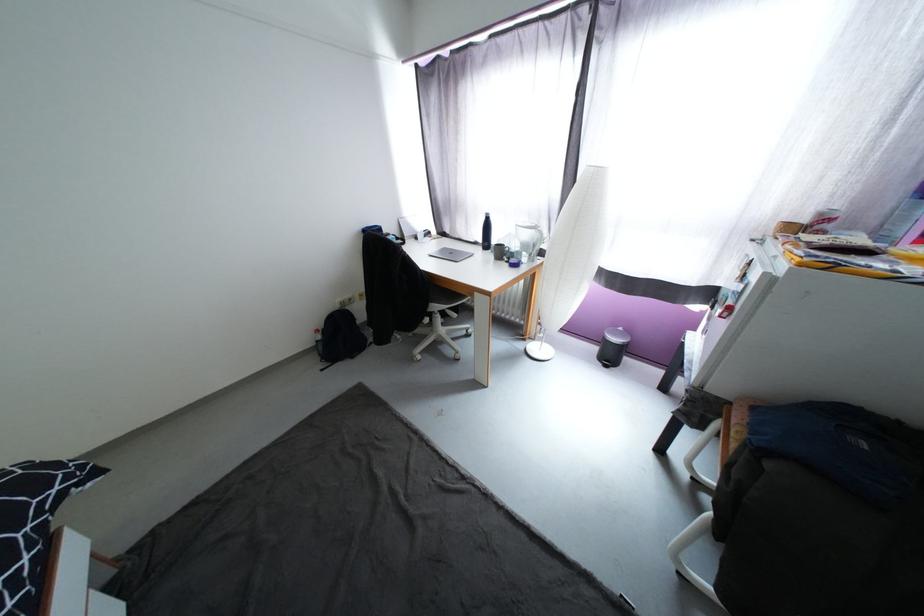
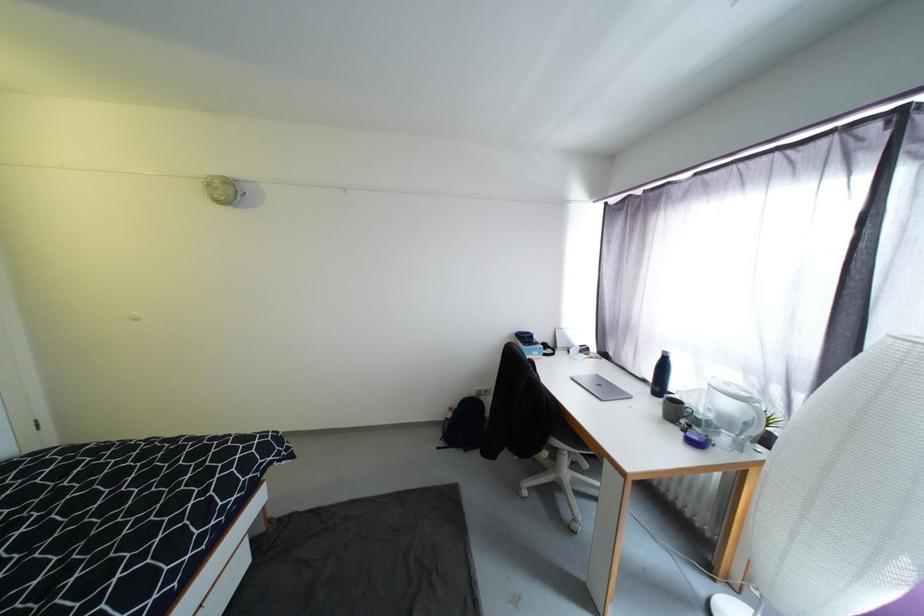
Locate, in the second image, the point that corresponds to [485,249] in the first image.

(654, 392)